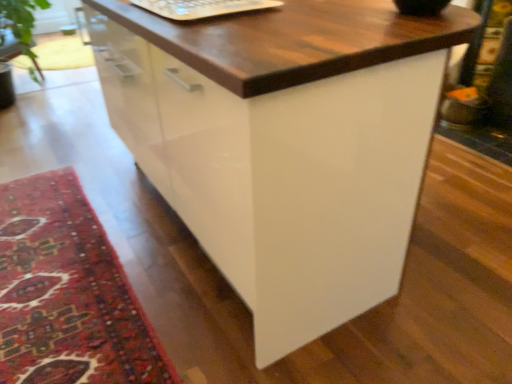
What do you see at coordinates (68, 293) in the screenshot? The width and height of the screenshot is (512, 384). I see `carpeted rug at lower left` at bounding box center [68, 293].

Locate an element on the screen. The height and width of the screenshot is (384, 512). carpeted rug at lower left is located at coordinates (68, 293).

What do you see at coordinates (202, 7) in the screenshot? I see `white plastic laptop keyboard at upper center` at bounding box center [202, 7].

Image resolution: width=512 pixels, height=384 pixels. What are the coordinates of `white plastic laptop keyboard at upper center` in the screenshot? It's located at (202, 7).

Measure the distance between white plastic laptop keyboard at upper center and camera.

1.25 meters.

Where is `carpeted rug at lower left`? This screenshot has height=384, width=512. carpeted rug at lower left is located at coordinates (68, 293).

Does white plastic laptop keyboard at upper center appear on the left side of carpeted rug at lower left?

Incorrect, white plastic laptop keyboard at upper center is not on the left side of carpeted rug at lower left.

Is white plastic laptop keyboard at upper center further to camera compared to carpeted rug at lower left?

Yes, white plastic laptop keyboard at upper center is further from the viewer.

Based on the photo, which point is more forward, (148,5) or (45,259)?

The point (148,5) is closer.

From the image's perspective, is white plastic laptop keyboard at upper center under carpeted rug at lower left?

No.

From a real-world perspective, who is located higher, white plastic laptop keyboard at upper center or carpeted rug at lower left?

white plastic laptop keyboard at upper center, from a real-world perspective.

Looking at this image, which of these two, white plastic laptop keyboard at upper center or carpeted rug at lower left, is thinner?

white plastic laptop keyboard at upper center.

In the scene shown: Does white plastic laptop keyboard at upper center have a greater height compared to carpeted rug at lower left?

Indeed, white plastic laptop keyboard at upper center has a greater height compared to carpeted rug at lower left.

Considering the sizes of objects white plastic laptop keyboard at upper center and carpeted rug at lower left in the image provided, who is bigger, white plastic laptop keyboard at upper center or carpeted rug at lower left?

carpeted rug at lower left is bigger.

Is white plastic laptop keyboard at upper center inside or outside of carpeted rug at lower left?

white plastic laptop keyboard at upper center lies outside carpeted rug at lower left.

Is there a large distance between white plastic laptop keyboard at upper center and carpeted rug at lower left?

Yes, white plastic laptop keyboard at upper center and carpeted rug at lower left are located far from each other.

Could you tell me if white plastic laptop keyboard at upper center is turned towards carpeted rug at lower left?

No, white plastic laptop keyboard at upper center does not turn towards carpeted rug at lower left.

Where is `mat lying on the left of white plastic laptop keyboard at upper center`? The image size is (512, 384). mat lying on the left of white plastic laptop keyboard at upper center is located at coordinates (68, 293).

Consider the image. Can you confirm if carpeted rug at lower left is positioned to the left of white plastic laptop keyboard at upper center?

Correct, you'll find carpeted rug at lower left to the left of white plastic laptop keyboard at upper center.

Which is in front, carpeted rug at lower left or white plastic laptop keyboard at upper center?

Positioned in front is carpeted rug at lower left.

Between point (36, 320) and point (188, 14), which one is positioned behind?

The point (36, 320) is more distant.

From the image's perspective, which one is positioned lower, carpeted rug at lower left or white plastic laptop keyboard at upper center?

From the image's view, carpeted rug at lower left is below.

From a real-world perspective, which is physically below, carpeted rug at lower left or white plastic laptop keyboard at upper center?

carpeted rug at lower left, from a real-world perspective.

Can you confirm if carpeted rug at lower left is thinner than white plastic laptop keyboard at upper center?

No.

Is carpeted rug at lower left shorter than white plastic laptop keyboard at upper center?

Yes.

Who is bigger, carpeted rug at lower left or white plastic laptop keyboard at upper center?

Bigger between the two is carpeted rug at lower left.

Is carpeted rug at lower left completely or partially outside of white plastic laptop keyboard at upper center?

Yes.

Is carpeted rug at lower left not close to white plastic laptop keyboard at upper center?

That's right, there is a large distance between carpeted rug at lower left and white plastic laptop keyboard at upper center.

Is white plastic laptop keyboard at upper center at the back of carpeted rug at lower left?

That's not correct — carpeted rug at lower left is not looking away from white plastic laptop keyboard at upper center.

How far apart are carpeted rug at lower left and white plastic laptop keyboard at upper center?

carpeted rug at lower left and white plastic laptop keyboard at upper center are 3.47 feet apart.

Where is `laptop keyboard above the carpeted rug at lower left (from the image's perspective)`? laptop keyboard above the carpeted rug at lower left (from the image's perspective) is located at coordinates (202, 7).

This screenshot has width=512, height=384. I want to click on mat located on the left of white plastic laptop keyboard at upper center, so click(x=68, y=293).

Where is `laptop keyboard above the carpeted rug at lower left (from a real-world perspective)`? This screenshot has width=512, height=384. laptop keyboard above the carpeted rug at lower left (from a real-world perspective) is located at coordinates (202, 7).